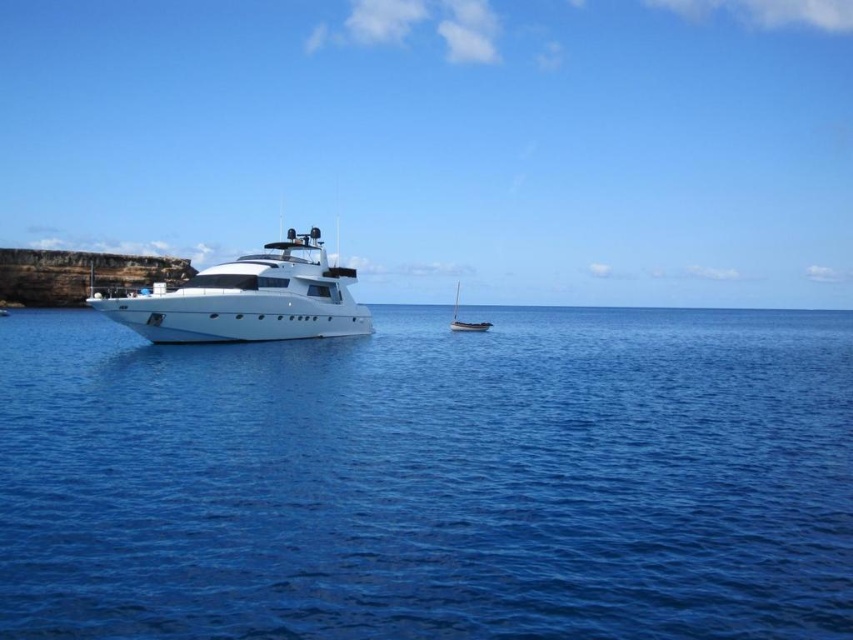
You are a marine biologist studying the positioning of vessels in the image. The white glossy yacht at center is at coordinates point 0.469, 0.292. What are its coordinates?

The white glossy yacht at center is located at coordinates point (248, 300).

You are a photographer planning to capture the white glossy yacht at center and the white glossy sailboat at center in a single shot. Based on their positions, which one will appear closer to the bottom edge of your photo?

The white glossy yacht at center is positioned under the white glossy sailboat at center, so it will appear closer to the bottom edge of the photo.

You are a sailor planning to anchor your boat in the area shown. You need to know the depth of the water at the coordinates point (x=431, y=477). Can you determine if it is safe to anchor there?

The point (x=431, y=477) indicates blue liquid water at center, so it is safe to anchor there as it is over water.